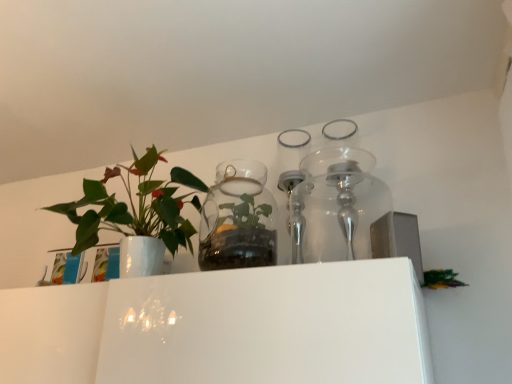
The image size is (512, 384). I want to click on transparent glass terrarium at center, so click(x=238, y=219).

Describe the element at coordinates (238, 219) in the screenshot. This screenshot has width=512, height=384. I see `transparent glass terrarium at center` at that location.

Find the location of `white glossy vase at left`. white glossy vase at left is located at coordinates (137, 214).

This screenshot has width=512, height=384. What do you see at coordinates (137, 214) in the screenshot? I see `white glossy vase at left` at bounding box center [137, 214].

Find the location of `transparent glass terrarium at center`. transparent glass terrarium at center is located at coordinates (238, 219).

Is transparent glass terrarium at center at the right side of white glossy vase at left?

Indeed, transparent glass terrarium at center is positioned on the right side of white glossy vase at left.

Is transparent glass terrarium at center positioned in front of white glossy vase at left?

No, the depth of transparent glass terrarium at center is greater than that of white glossy vase at left.

Which is behind, point (258, 195) or point (89, 198)?

Point (258, 195)

From the image's perspective, is transparent glass terrarium at center on top of white glossy vase at left?

Incorrect, from the image's perspective, transparent glass terrarium at center is lower than white glossy vase at left.

From a real-world perspective, between transparent glass terrarium at center and white glossy vase at left, who is vertically lower?

transparent glass terrarium at center.

From the picture: Considering the sizes of objects transparent glass terrarium at center and white glossy vase at left in the image provided, who is wider, transparent glass terrarium at center or white glossy vase at left?

With larger width is white glossy vase at left.

Considering the sizes of objects transparent glass terrarium at center and white glossy vase at left in the image provided, who is shorter, transparent glass terrarium at center or white glossy vase at left?

Standing shorter between the two is transparent glass terrarium at center.

Considering the sizes of objects transparent glass terrarium at center and white glossy vase at left in the image provided, who is smaller, transparent glass terrarium at center or white glossy vase at left?

transparent glass terrarium at center.

Is white glossy vase at left completely or partially inside transparent glass terrarium at center?

No, white glossy vase at left is not a part of transparent glass terrarium at center.

Consider the image. Would you consider transparent glass terrarium at center to be distant from white glossy vase at left?

They are positioned close to each other.

Is transparent glass terrarium at center facing away from white glossy vase at left?

transparent glass terrarium at center does not have its back to white glossy vase at left.

How different are the orientations of transparent glass terrarium at center and white glossy vase at left in degrees?

3.63 degrees.

This screenshot has height=384, width=512. Find the location of `vase on the right of white glossy vase at left`. vase on the right of white glossy vase at left is located at coordinates (238, 219).

Does white glossy vase at left appear on the left side of transparent glass terrarium at center?

Indeed, white glossy vase at left is positioned on the left side of transparent glass terrarium at center.

Considering the positions of objects white glossy vase at left and transparent glass terrarium at center in the image provided, who is in front, white glossy vase at left or transparent glass terrarium at center?

Positioned in front is white glossy vase at left.

Which is in front, point (205, 192) or point (251, 210)?

The point (205, 192) is more forward.

From the image's perspective, is white glossy vase at left located beneath transparent glass terrarium at center?

Incorrect, from the image's perspective, white glossy vase at left is higher than transparent glass terrarium at center.

From a real-world perspective, relative to transparent glass terrarium at center, is white glossy vase at left vertically above or below?

In terms of real-world spatial position, white glossy vase at left is above transparent glass terrarium at center.

Considering the sizes of objects white glossy vase at left and transparent glass terrarium at center in the image provided, who is thinner, white glossy vase at left or transparent glass terrarium at center?

transparent glass terrarium at center.

Does white glossy vase at left have a lesser height compared to transparent glass terrarium at center?

No, white glossy vase at left is not shorter than transparent glass terrarium at center.

Considering the sizes of objects white glossy vase at left and transparent glass terrarium at center in the image provided, who is bigger, white glossy vase at left or transparent glass terrarium at center?

white glossy vase at left.

Is white glossy vase at left outside of transparent glass terrarium at center?

white glossy vase at left lies outside transparent glass terrarium at center's area.

Is there a large distance between white glossy vase at left and transparent glass terrarium at center?

That's not correct — white glossy vase at left is a little close to transparent glass terrarium at center.

Is white glossy vase at left oriented towards transparent glass terrarium at center?

No, white glossy vase at left is not facing towards transparent glass terrarium at center.

How many degrees apart are the facing directions of white glossy vase at left and transparent glass terrarium at center?

3.63 degrees.

I want to click on vase directly beneath the white glossy vase at left (from a real-world perspective), so click(x=238, y=219).

Locate an element on the screen. The width and height of the screenshot is (512, 384). vase behind the white glossy vase at left is located at coordinates (238, 219).

Image resolution: width=512 pixels, height=384 pixels. I want to click on vase below the white glossy vase at left (from the image's perspective), so click(x=238, y=219).